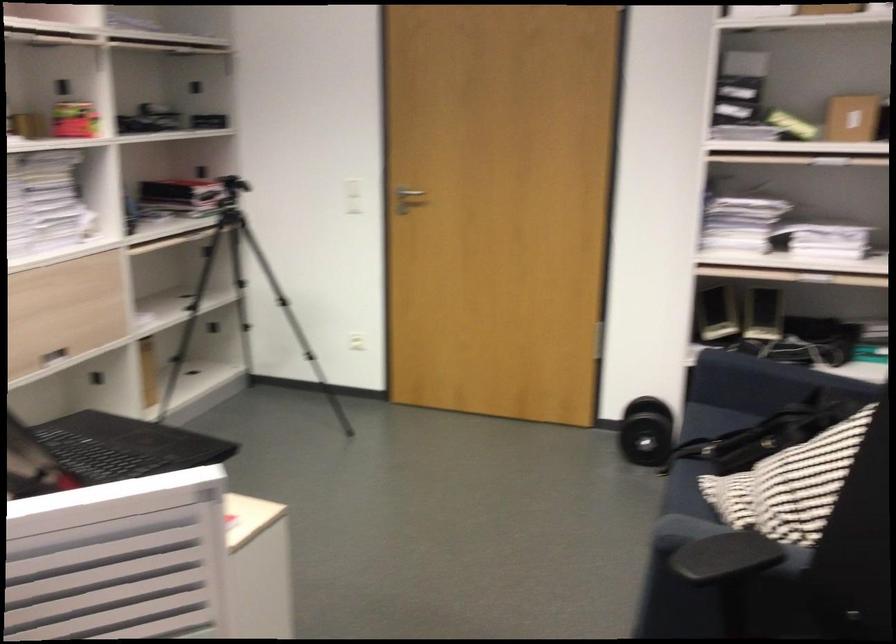
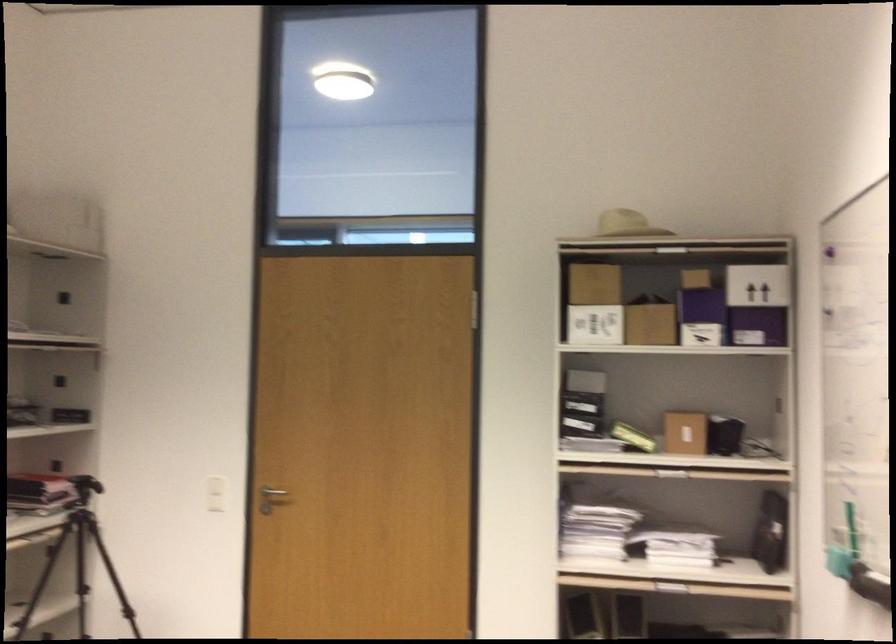
Where in the second image is the point corresponding to pixel 409 192 from the first image?

(272, 491)